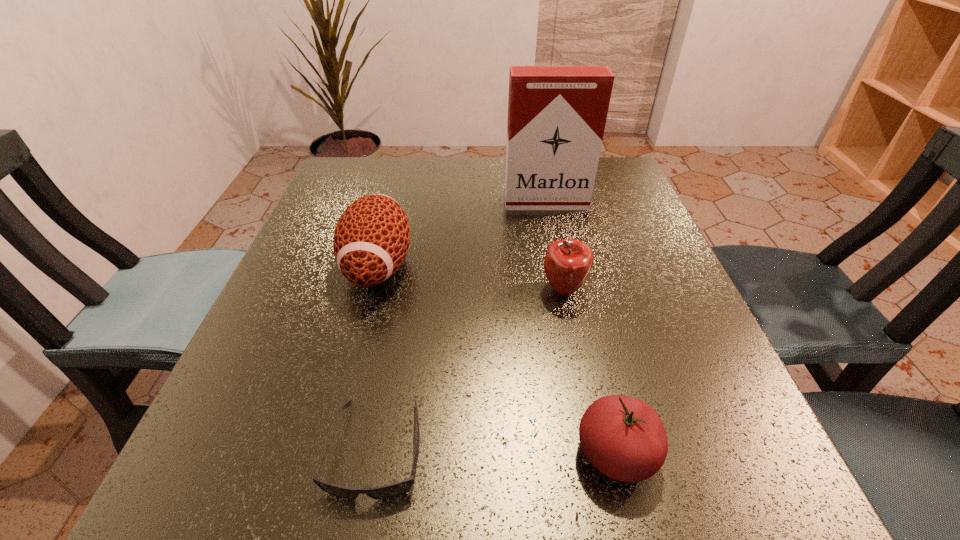
Locate an element on the screen. vacant space at the right edge is located at coordinates (665, 356).

Image resolution: width=960 pixels, height=540 pixels. I want to click on free region at the far left corner, so click(334, 193).

Where is `vacant space at the near right corner of the desktop`? The height and width of the screenshot is (540, 960). vacant space at the near right corner of the desktop is located at coordinates (760, 476).

Identify the location of empty location between the apple and the football. (471, 278).

Image resolution: width=960 pixels, height=540 pixels. Find the location of `vacant area that lies between the apple and the sunglasses`. vacant area that lies between the apple and the sunglasses is located at coordinates (469, 370).

Find the location of a particular element. free space between the farthest object and the tomato is located at coordinates (581, 328).

Where is `free spot between the apple and the fourth shortest object`? The width and height of the screenshot is (960, 540). free spot between the apple and the fourth shortest object is located at coordinates (471, 278).

Find the location of a particular element. Image resolution: width=960 pixels, height=540 pixels. free space between the cigarette_case and the second tallest object is located at coordinates (462, 234).

Locate an element on the screen. This screenshot has height=540, width=960. unoccupied position between the farthest object and the sunglasses is located at coordinates (461, 326).

The image size is (960, 540). In order to click on empty location between the football and the tomato in this screenshot , I will do `click(497, 359)`.